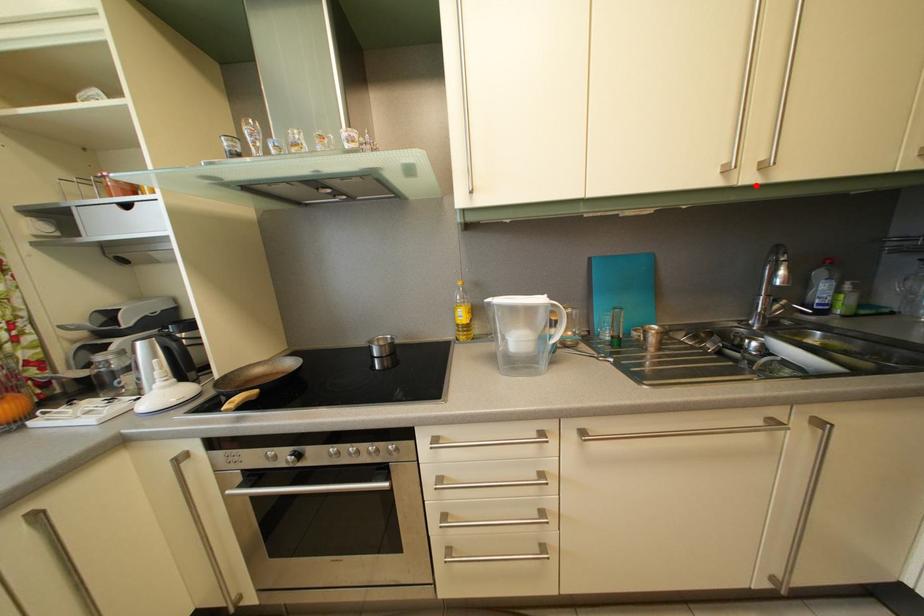
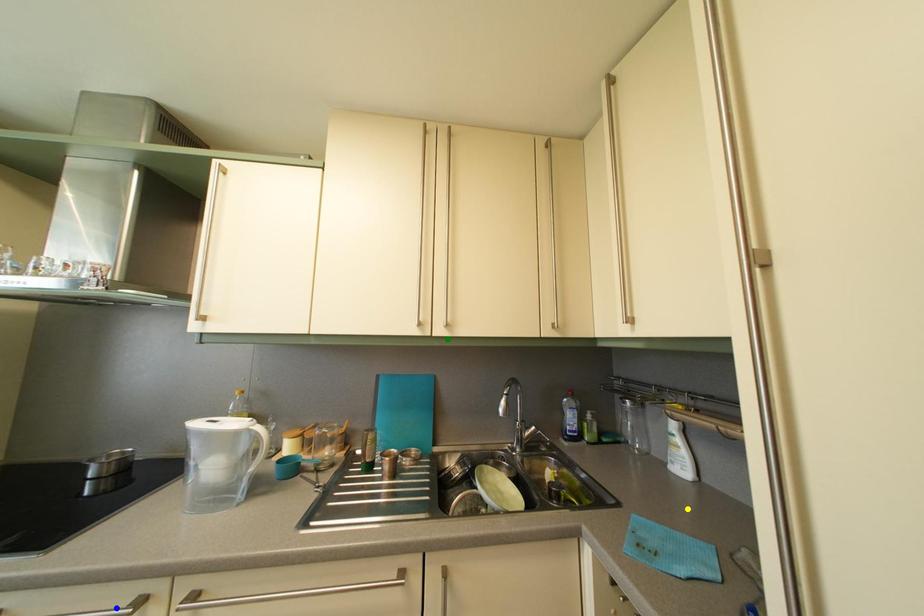
Question: I am providing you with two images of the same scene from different viewpoints. A red point is marked on the first image. You are given multiple points on the second image. Which point in image 2 is actually the same real-world point as the red point in image 1?

Choices:
 (A) green point
 (B) yellow point
 (C) blue point

Answer: (A)